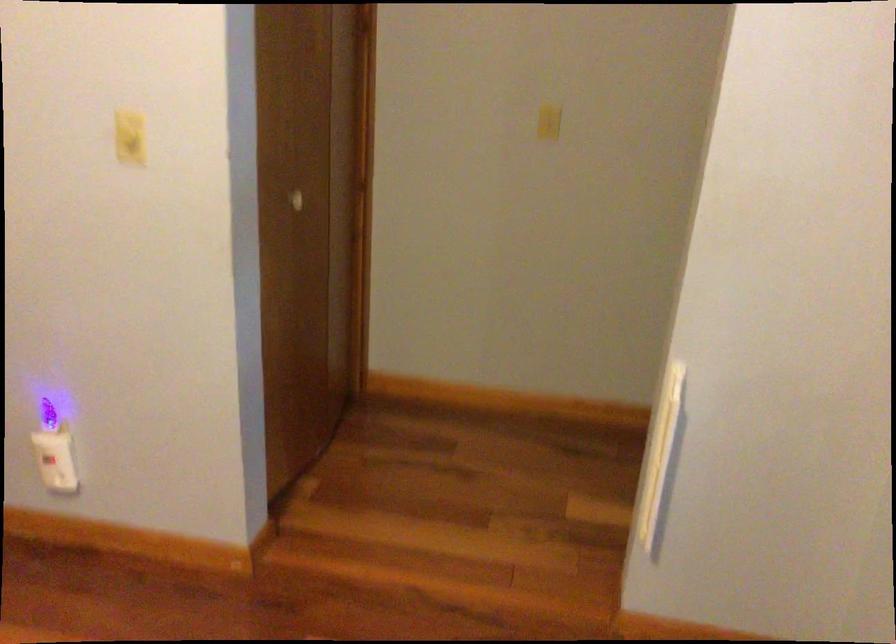
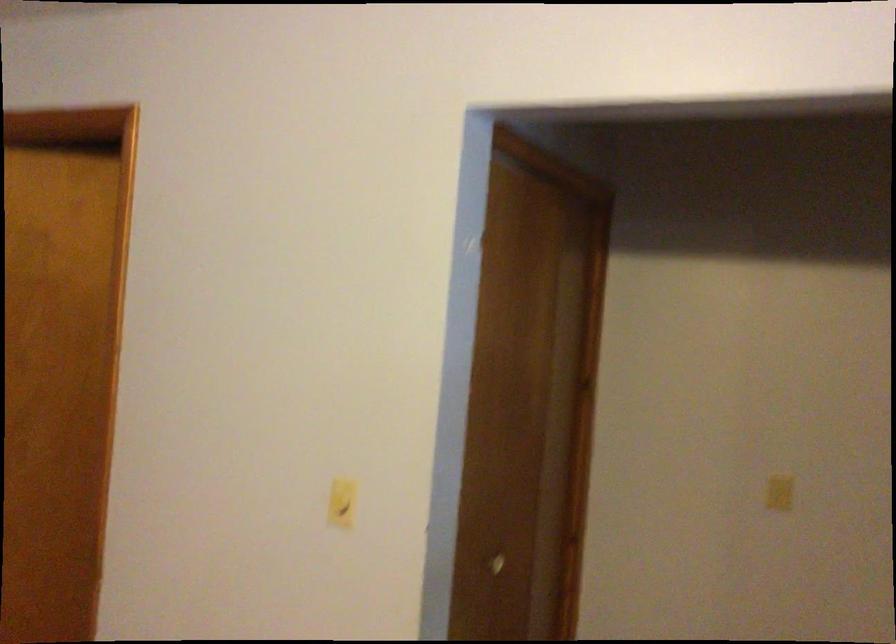
In the second image, find the point that corresponds to (123,128) in the first image.

(340, 502)